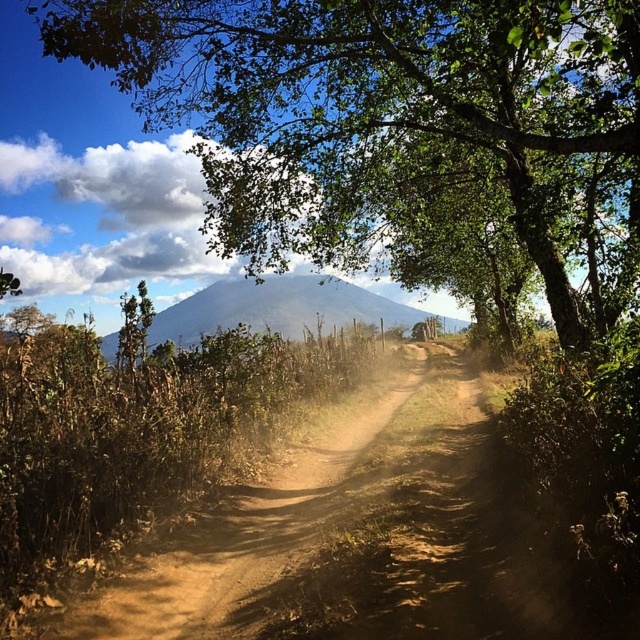
You are a hiker standing on the dirt path in the image. You notice the green leafy tree at center and the gray matte mountain at center. Which object is positioned higher in the scene?

The green leafy tree at center is located above the gray matte mountain at center, so it is positioned higher in the scene.

You are a hiker standing at the start of the dirt path and want to reach the green leafy tree at center and the gray matte mountain at center. Based on their positions relative to each other, which one would you encounter first along the path?

The green leafy tree at center is positioned on the right side of the gray matte mountain at center, so you would encounter the green leafy tree at center first before reaching the gray matte mountain at center.

You are a hiker standing on the dirt path in the rural landscape. You notice the green leafy tree at center and the gray matte mountain at center. Which object appears closer to you based on their sizes?

The green leafy tree at center appears closer because it has a smaller size compared to the gray matte mountain at center, which is farther away and thus appears smaller in reality.